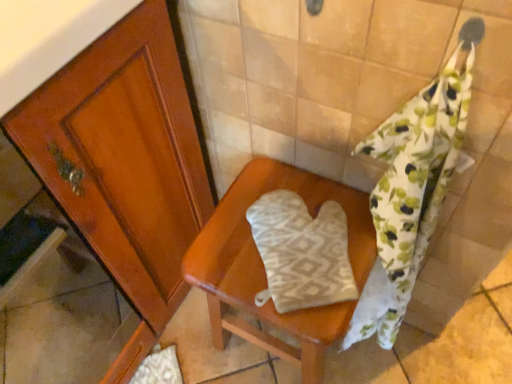
I want to click on vacant space underneath white textured oven mitt at center (from a real-world perspective), so click(x=300, y=256).